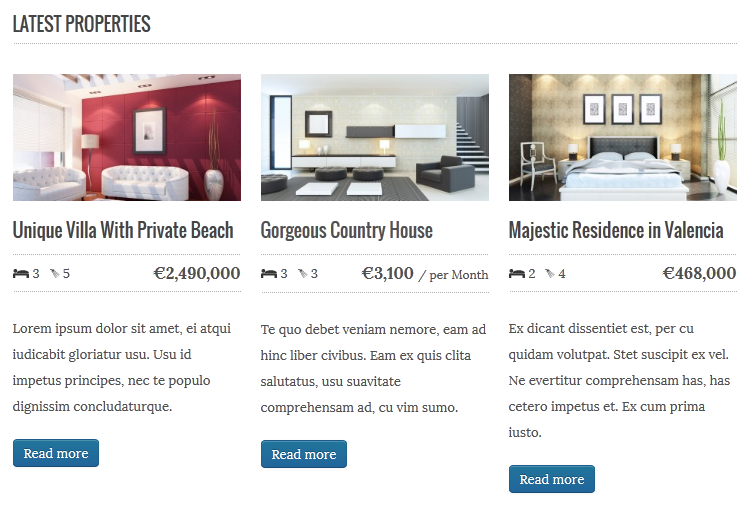
The image size is (754, 520). What are the coordinates of `plant` in the screenshot? It's located at (213, 152), (719, 146).